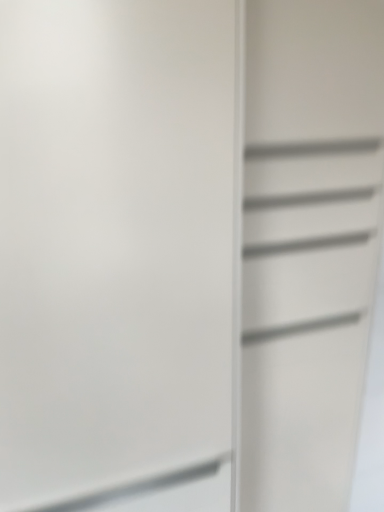
Measure the distance between white matte cabinet at right and camera.

A distance of 27.90 inches exists between white matte cabinet at right and camera.

The image size is (384, 512). What do you see at coordinates (308, 245) in the screenshot?
I see `white matte cabinet at right` at bounding box center [308, 245].

I want to click on white matte cabinet at right, so click(x=308, y=245).

You are a GUI agent. You are given a task and a screenshot of the screen. Output one action in this format:
    pyautogui.click(x=<x>, y=<y>)
    Task: Click on the white matte cabinet at right
    
    Given the screenshot: What is the action you would take?
    click(308, 245)